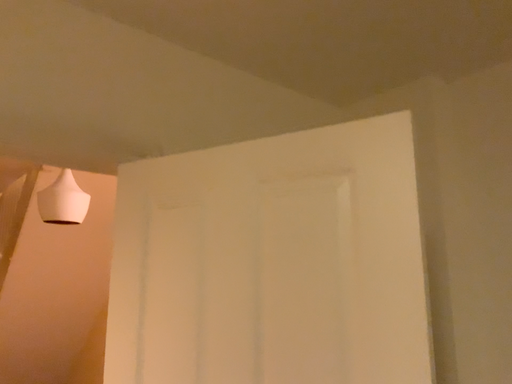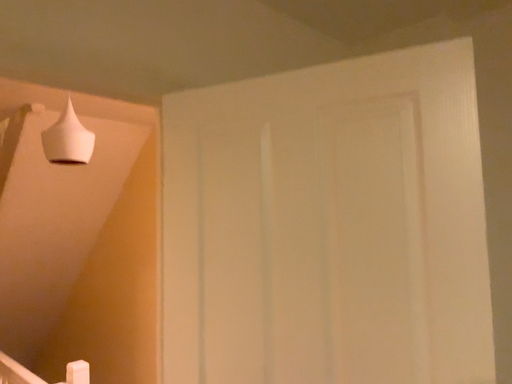
Question: Which way did the camera rotate in the video?

Choices:
 (A) rotated upward
 (B) rotated downward

Answer: (B)